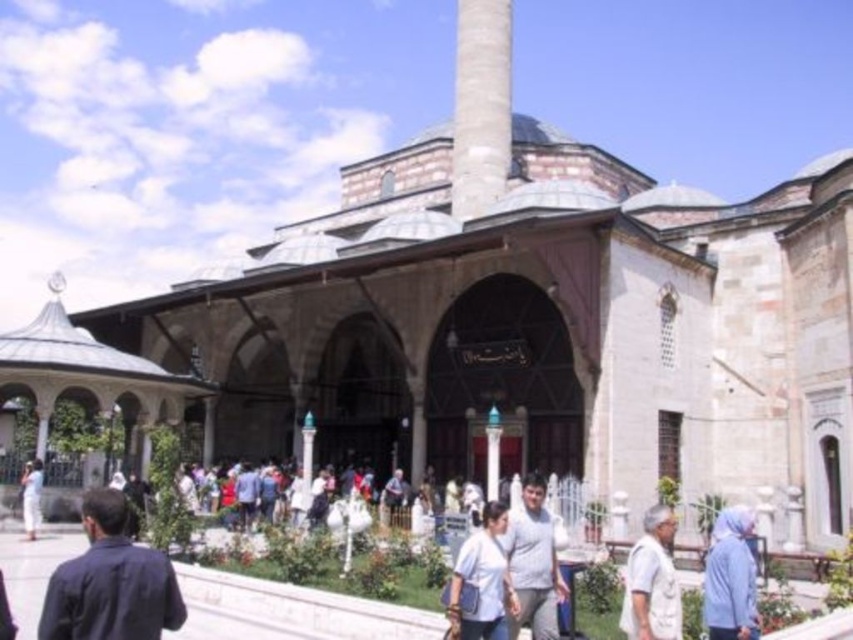
Which is in front, point (167, 624) or point (32, 493)?

Point (167, 624) is in front.

Is point (125, 580) closer to viewer compared to point (32, 532)?

Yes, it is.

Between point (88, 588) and point (38, 496), which one is positioned in front?

Point (88, 588) is more forward.

What are the coordinates of `dark blue shirt at lower left` in the screenshot? It's located at (109, 580).

Which of these two, dark blue shirt at lower left or white cotton shirt at center, stands shorter?

white cotton shirt at center is shorter.

Who is positioned more to the left, dark blue shirt at lower left or white cotton shirt at center?

dark blue shirt at lower left is more to the left.

Locate an element on the screen. Image resolution: width=853 pixels, height=640 pixels. dark blue shirt at lower left is located at coordinates (109, 580).

Between point (535, 602) and point (747, 563), which one is positioned behind?

Point (535, 602)

Is gray cotton shirt at center thinner than light blue fabric at lower right?

Correct, gray cotton shirt at center's width is less than light blue fabric at lower right's.

Between point (517, 550) and point (746, 627), which one is positioned behind?

Point (517, 550)

Locate an element on the screen. gray cotton shirt at center is located at coordinates (532, 563).